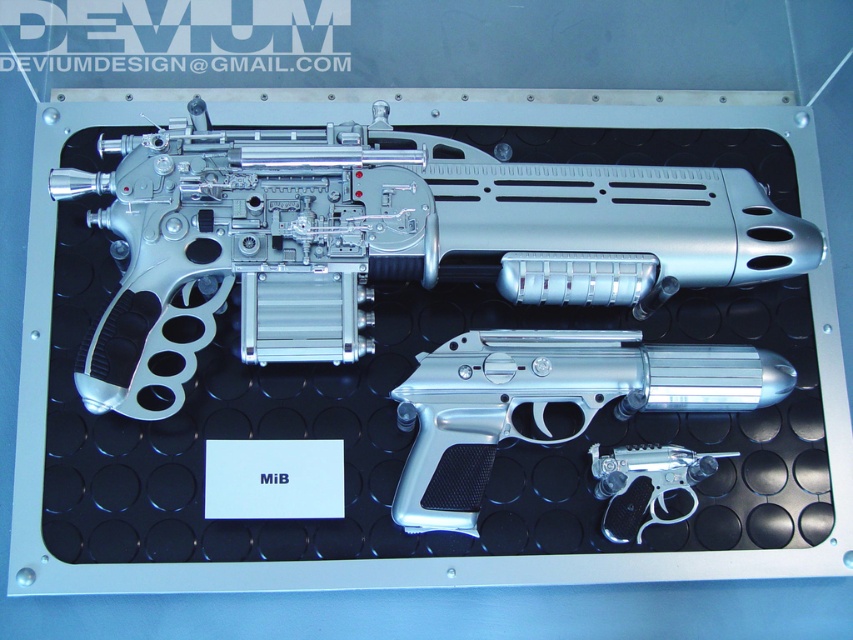
You are standing 1.48 meters away from the point at coordinates (537,426) in the scene. Can you reach the firearm displayed there without moving closer?

The point at coordinates (537,426) is 1.48 meters away from you. Since the firearm is displayed there, you can reach it without moving closer.

What is the exact position of the silver metallic rifle at upper center in the display case?

The silver metallic rifle at upper center is located at point (x=384, y=237).

You are a collector who wants to know which firearm takes up more space in the display case. Which one is bigger, the silver metallic rifle at upper center or the polished silver handgun at lower right?

The silver metallic rifle at upper center is larger in size compared to the polished silver handgun at lower right, so it takes up more space in the display case.